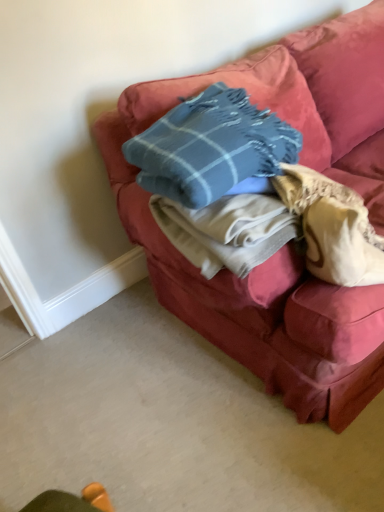
What do you see at coordinates (291, 241) in the screenshot? I see `velvet-like pink couch at center` at bounding box center [291, 241].

At what (x,y) coordinates should I click in order to perform the action: click on velvet-like pink couch at center. Please return your answer as a coordinate pair (x, y). Looking at the image, I should click on (291, 241).

Find the location of a particular element. This screenshot has width=384, height=512. velvet-like pink couch at center is located at coordinates (291, 241).